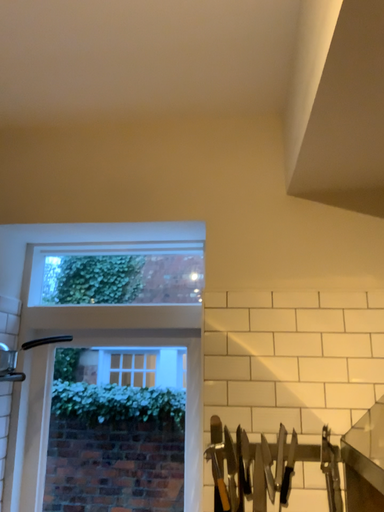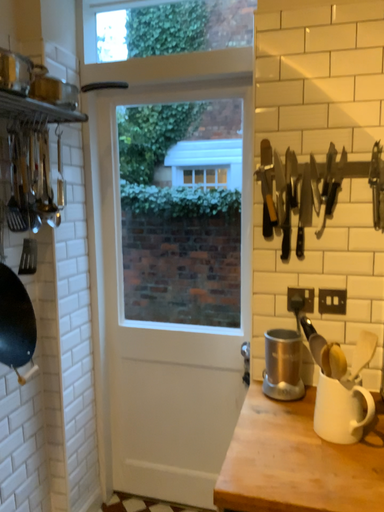
Question: How did the camera likely rotate when shooting the video?

Choices:
 (A) rotated downward
 (B) rotated upward

Answer: (A)